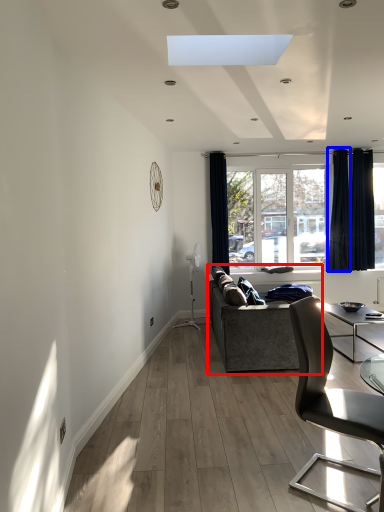
Question: Which object is further to the camera taking this photo, studio couch (highlighted by a red box) or curtain (highlighted by a blue box)?

Choices:
 (A) studio couch
 (B) curtain

Answer: (B)